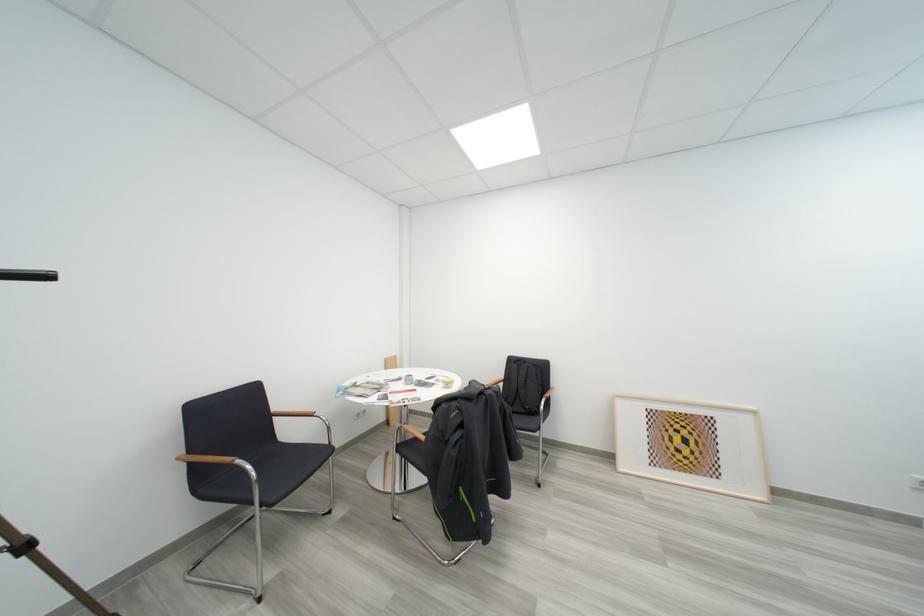
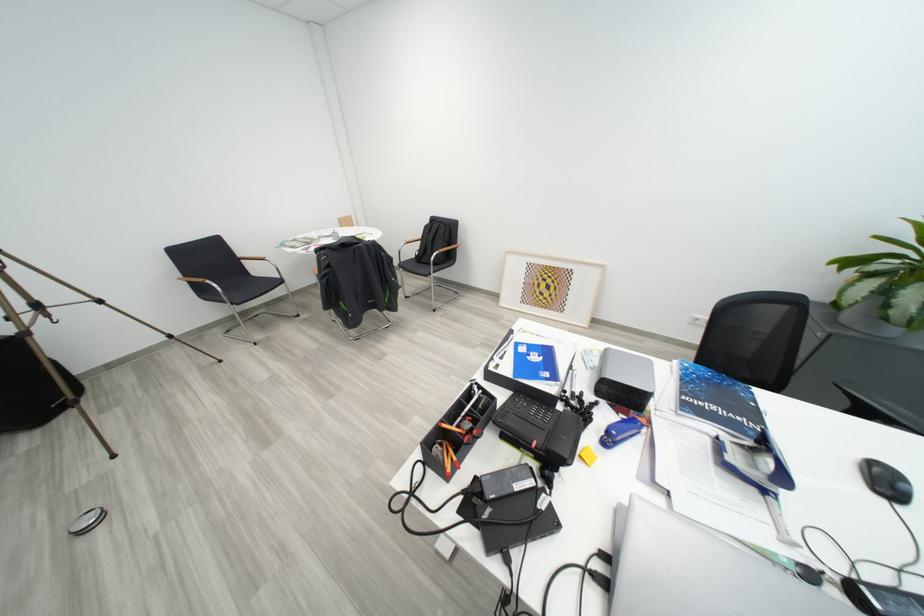
The point at (552, 405) is marked in the first image. Where is the corresponding point in the second image?

(444, 257)